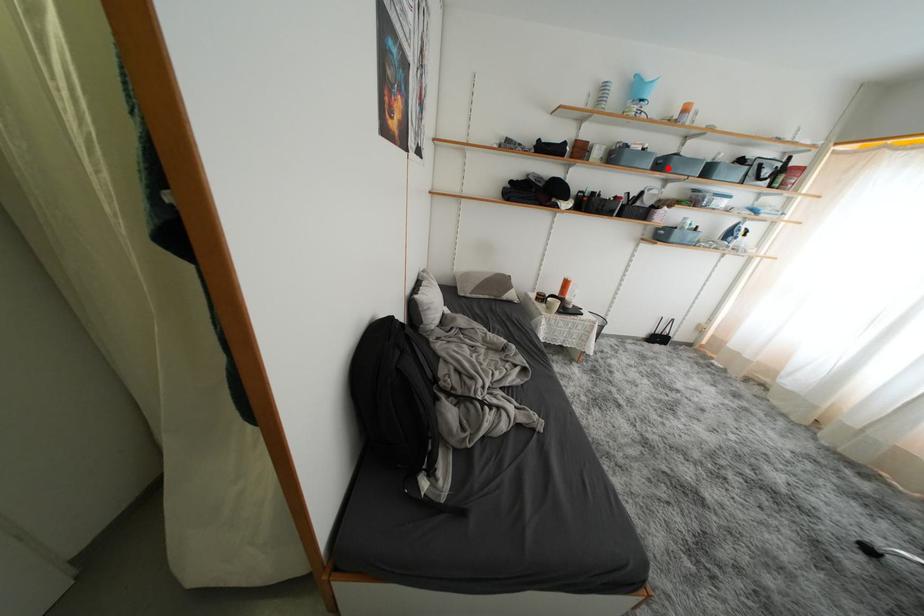
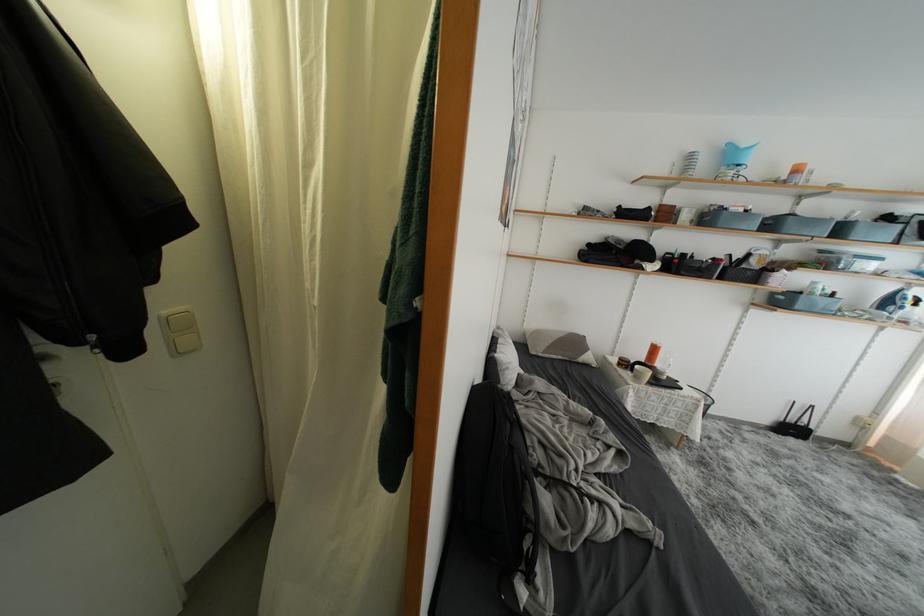
Where in the second image is the point corresponding to the highlighted location from the first image?

(777, 229)